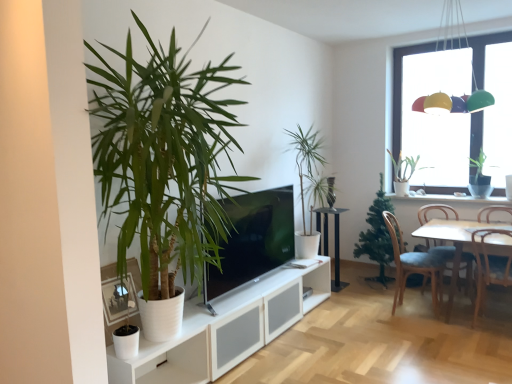
You are a GUI agent. You are given a task and a screenshot of the screen. Output one action in this format:
    pyautogui.click(x=<x>, y=<y>)
    Task: Click on the free location to the left of blue fabric chair at lower right, which ranks as the 1th chair in left-to-right order
    The image size is (512, 384).
    Given the screenshot: What is the action you would take?
    (x=367, y=310)